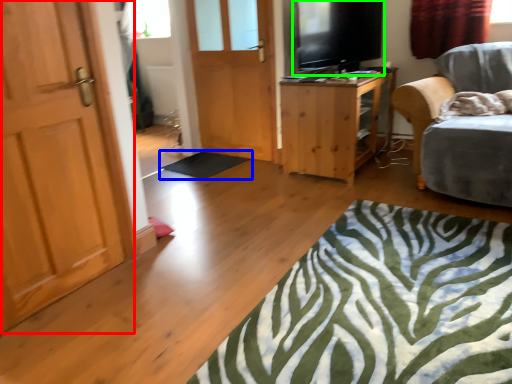
Question: Estimate the real-world distances between objects in this image. Which object is closer to door (highlighted by a red box), flat (highlighted by a blue box) or level (highlighted by a green box)?

Choices:
 (A) flat
 (B) level

Answer: (A)